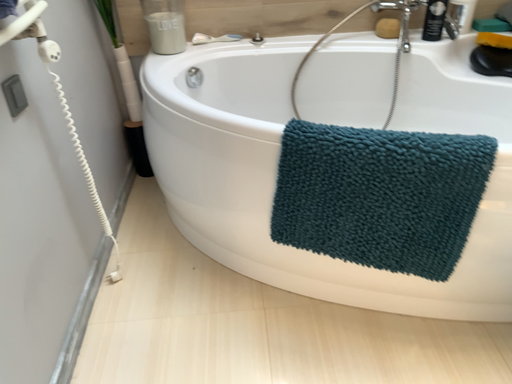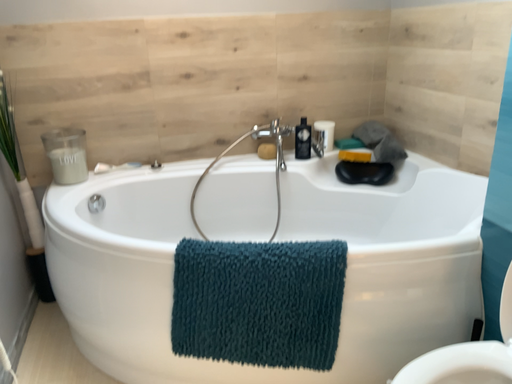
Question: How did the camera likely rotate when shooting the video?

Choices:
 (A) rotated left
 (B) rotated right

Answer: (B)